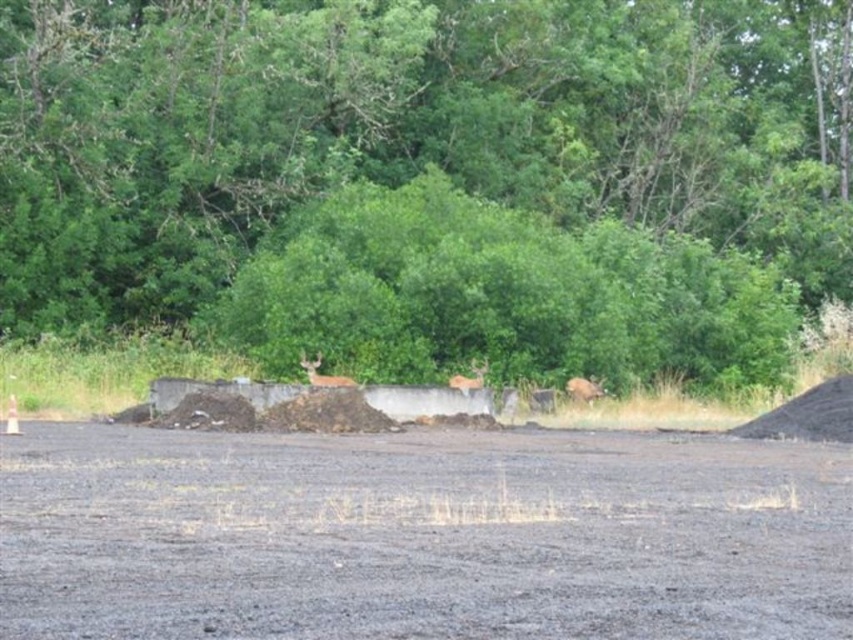
Consider the image. Between gray gravel dirt track at center and brown matte/deer at center, which one has less height?

Standing shorter between the two is gray gravel dirt track at center.

Between gray gravel dirt track at center and brown matte/deer at center, which one is positioned lower?

gray gravel dirt track at center

Is point (125, 433) closer to viewer compared to point (480, 384)?

Yes, point (125, 433) is closer to viewer.

Find the location of `gray gravel dirt track at center`. gray gravel dirt track at center is located at coordinates (421, 536).

Can you confirm if brown fur deer at center is positioned above brown matte/deer at center?

No.

Does brown fur deer at center have a lesser height compared to brown matte/deer at center?

No, brown fur deer at center is not shorter than brown matte/deer at center.

Is point (338, 384) farther from camera compared to point (469, 378)?

That is False.

The width and height of the screenshot is (853, 640). What are the coordinates of `brown fur deer at center` in the screenshot? It's located at (322, 374).

Measure the distance between gray gravel dirt track at center and brown fur deer at center.

32.60 feet

Between point (393, 589) and point (315, 380), which one is positioned behind?

The point (315, 380) is behind.

This screenshot has height=640, width=853. In order to click on gray gravel dirt track at center in this screenshot , I will do click(x=421, y=536).